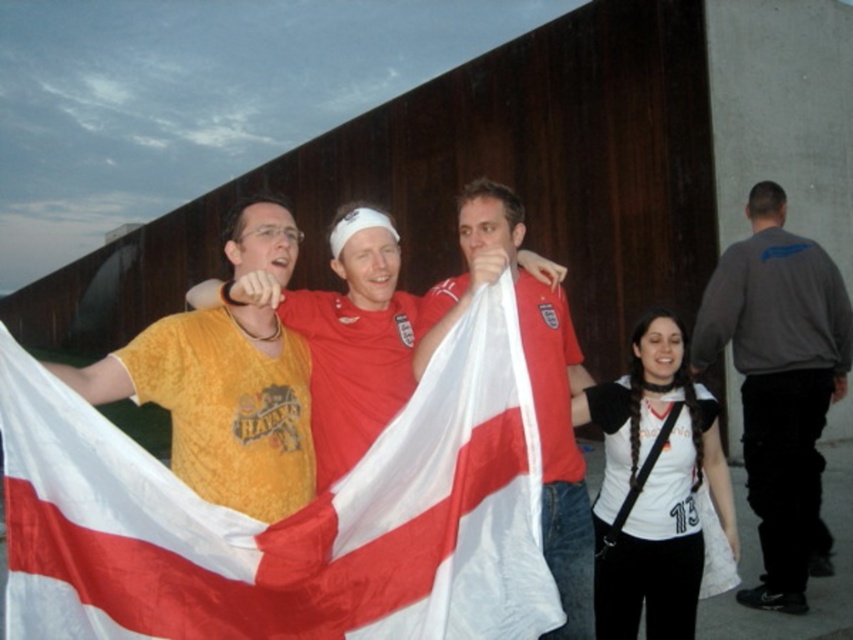
Question: Estimate the real-world distances between objects in this image. Which object is farther from the white matte shirt at center?

Choices:
 (A) matte red shirt at center
 (B) red fabric flag at center

Answer: (A)

Question: Which point is farther to the camera?

Choices:
 (A) (503, 544)
 (B) (643, 330)
 (C) (775, 435)
 (D) (392, 296)

Answer: (C)

Question: Can you confirm if dark gray sweatshirt at right is positioned to the left of red fabric flag at center?

Choices:
 (A) no
 (B) yes

Answer: (A)

Question: Is whitematerial/textureflag at center positioned before dark gray sweatshirt at right?

Choices:
 (A) yes
 (B) no

Answer: (A)

Question: Estimate the real-world distances between objects in this image. Which object is farther from the white matte shirt at center?

Choices:
 (A) matte red shirt at center
 (B) red fabric flag at center
 (C) dark gray sweatshirt at right
 (D) whitematerial/textureflag at center

Answer: (D)

Question: Can you confirm if matte red shirt at center is thinner than red fabric flag at center?

Choices:
 (A) yes
 (B) no

Answer: (A)